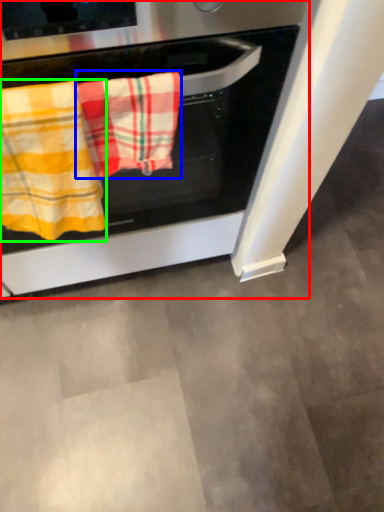
Question: Which is farther away from oven (highlighted by a red box)? beach towel (highlighted by a blue box) or beach towel (highlighted by a green box)?

Choices:
 (A) beach towel
 (B) beach towel

Answer: (B)